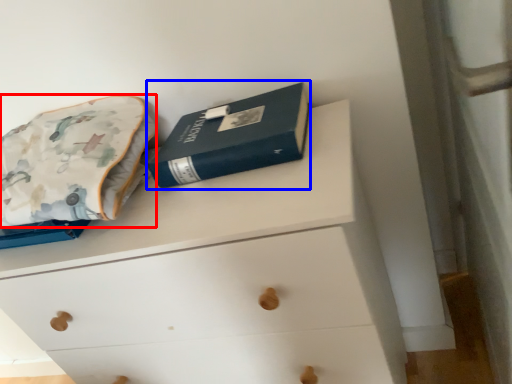
Question: Which object is closer to the camera taking this photo, throw pillow (highlighted by a red box) or paperback book (highlighted by a blue box)?

Choices:
 (A) throw pillow
 (B) paperback book

Answer: (A)